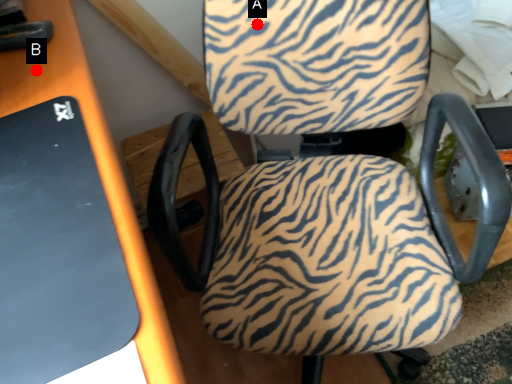
Question: Two points are circled on the image, labeled by A and B beside each circle. Which point is closer to the camera?

Choices:
 (A) A is closer
 (B) B is closer

Answer: (B)